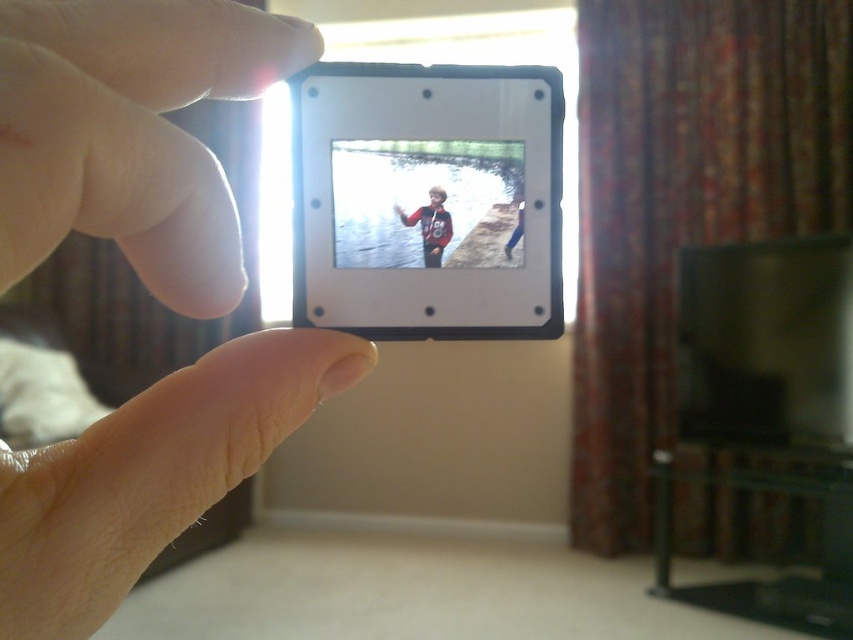
Question: Considering the relative positions of white matte hand at upper left and matte red shirt at center in the image provided, where is white matte hand at upper left located with respect to matte red shirt at center?

Choices:
 (A) right
 (B) left

Answer: (B)

Question: Which point is farther to the camera?

Choices:
 (A) (61, 20)
 (B) (196, 289)
 (C) (393, 209)

Answer: (C)

Question: Which point is farther to the camera?

Choices:
 (A) (16, 202)
 (B) (84, 200)

Answer: (B)

Question: Is white plastic photo frame at center to the left of white matte hand at upper left from the viewer's perspective?

Choices:
 (A) no
 (B) yes

Answer: (A)

Question: Which point is farther from the camera taking this photo?

Choices:
 (A) (109, 580)
 (B) (436, 202)

Answer: (B)

Question: Can you confirm if matte plastic hand at center is wider than white plastic photo frame at center?

Choices:
 (A) yes
 (B) no

Answer: (B)